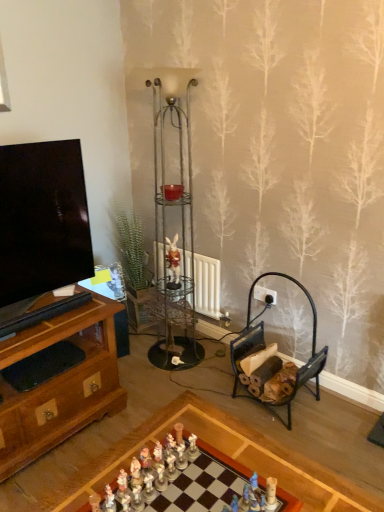
Find the location of a particular element. free space that is in between matte blue figurine at center, which is counted as the 3th toy, starting from the back, and shiny silver chess piece at center, the 2th toy positioned from the back is located at coordinates (198, 497).